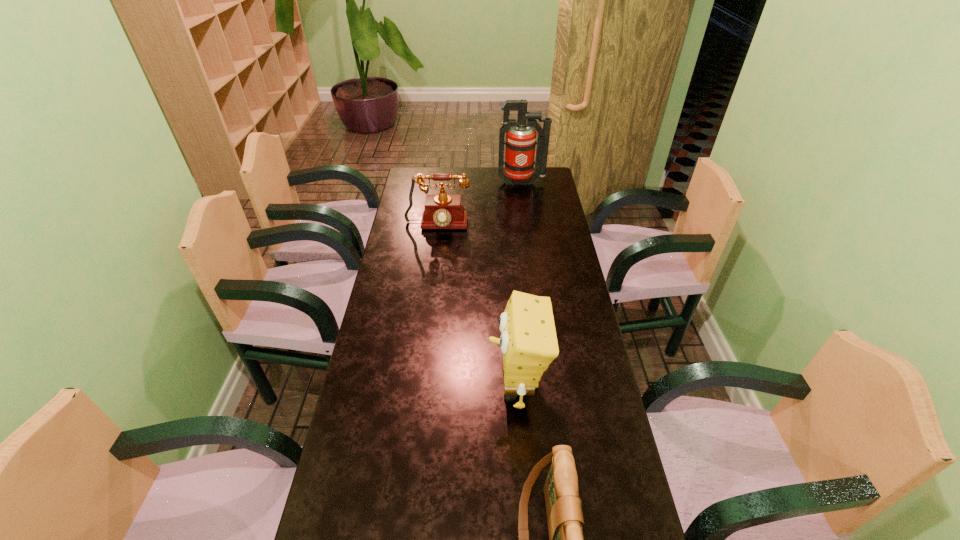
Where is `free location located on the dial of the second shortest object`? free location located on the dial of the second shortest object is located at coordinates (430, 286).

Where is `object that is at the far edge`? This screenshot has height=540, width=960. object that is at the far edge is located at coordinates (520, 142).

Where is `object positioned at the left edge`? object positioned at the left edge is located at coordinates (442, 211).

Locate an element on the screen. Image resolution: width=960 pixels, height=540 pixels. object positioned at the right edge is located at coordinates (520, 142).

Identify the location of object at the far right corner. (520, 142).

The width and height of the screenshot is (960, 540). In order to click on free point at the far edge in this screenshot , I will do `click(510, 188)`.

The image size is (960, 540). I want to click on vacant region at the left edge of the desktop, so click(x=353, y=510).

In the image, there is a desktop. Identify the location of vacant space at the right edge. pos(532,233).

What are the coordinates of `unoccupied position between the third shortest object and the third tallest object` in the screenshot? It's located at (477, 306).

At what (x,y) coordinates should I click in order to perform the action: click on free spot between the fire extinguisher and the telephone. Please return your answer as a coordinate pair (x, y). This screenshot has width=960, height=540. Looking at the image, I should click on (479, 205).